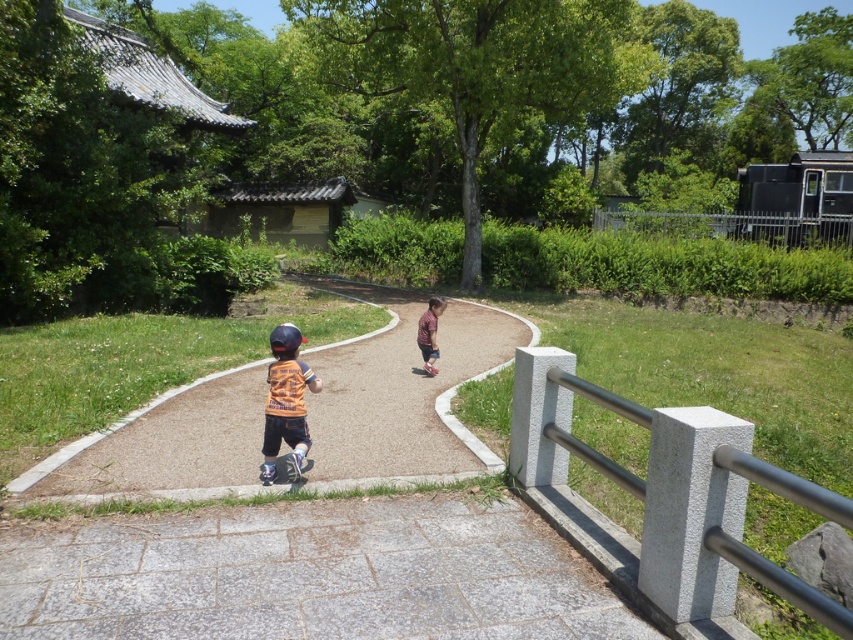
Question: Does orange jersey at center have a larger size compared to matte black helmet at center?

Choices:
 (A) yes
 (B) no

Answer: (A)

Question: Is brown asphalt path at center below matte black helmet at center?

Choices:
 (A) yes
 (B) no

Answer: (A)

Question: Can you confirm if black rubber skateboard at center is positioned to the left of matte black helmet at center?

Choices:
 (A) yes
 (B) no

Answer: (A)

Question: Which point is closer to the camera?

Choices:
 (A) brown asphalt path at center
 (B) red rubber skateboard at center
 (C) black rubber skateboard at center

Answer: (A)

Question: Among these points, which one is nearest to the camera?

Choices:
 (A) (271, 369)
 (B) (846, 625)
 (C) (296, 464)

Answer: (B)

Question: Which object appears closest to the camera in this image?

Choices:
 (A) metallic fence at upper right
 (B) orange jersey at center
 (C) gray concrete rail at right

Answer: (C)